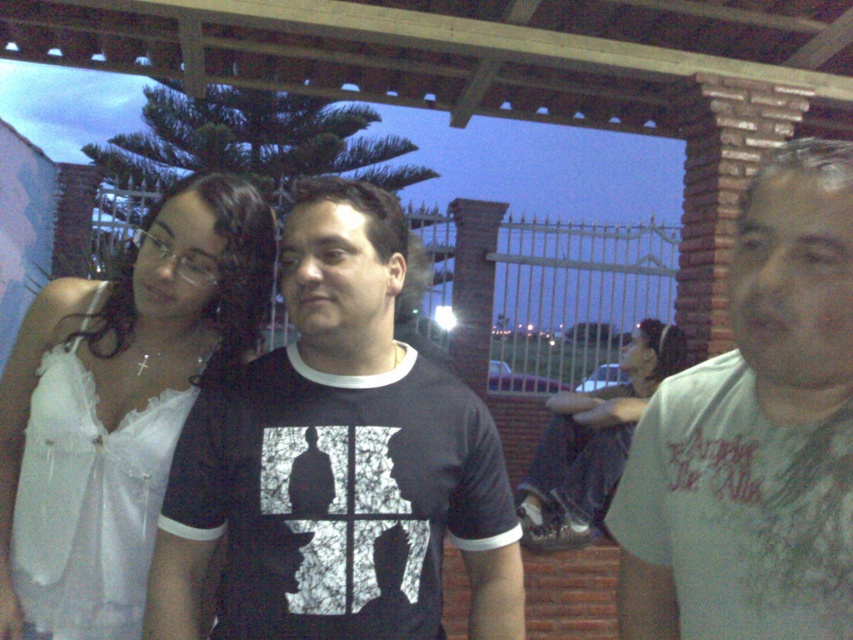
Is black matte t-shirt at center above jeans at lower right?

Yes.

Is point (157, 593) in front of point (556, 525)?

Yes, point (157, 593) is in front of point (556, 525).

What are the coordinates of `black matte t-shirt at center` in the screenshot? It's located at (337, 460).

Between black matte t-shirt at center and white satin blouse at left, which one has less height?

black matte t-shirt at center is shorter.

Is black matte t-shirt at center positioned at the back of white satin blouse at left?

No, it is not.

At what (x,y) coordinates should I click in order to perform the action: click on black matte t-shirt at center. Please return your answer as a coordinate pair (x, y). Looking at the image, I should click on (337, 460).

Locate an element on the screen. Image resolution: width=853 pixels, height=640 pixels. black matte t-shirt at center is located at coordinates (337, 460).

Does white cotton t-shirt at right appear on the right side of white satin blouse at left?

Yes, white cotton t-shirt at right is to the right of white satin blouse at left.

What are the coordinates of `white cotton t-shirt at right` in the screenshot? It's located at (755, 433).

The height and width of the screenshot is (640, 853). I want to click on white cotton t-shirt at right, so click(755, 433).

The width and height of the screenshot is (853, 640). I want to click on white cotton t-shirt at right, so click(x=755, y=433).